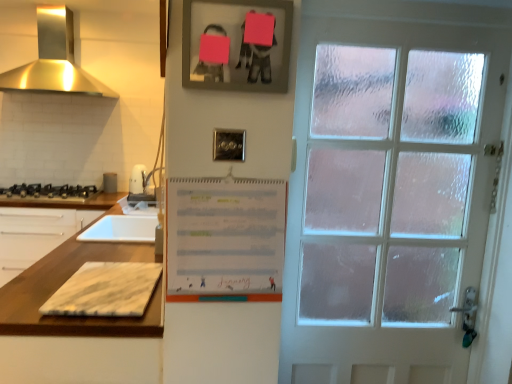
Image resolution: width=512 pixels, height=384 pixels. What are the coordinates of `black matte gas stove at left` in the screenshot? It's located at (49, 191).

Is metallic silver toaster at left wider than satin gold stainless steel exhaust hood at upper left?

Incorrect, the width of metallic silver toaster at left does not surpass that of satin gold stainless steel exhaust hood at upper left.

From the image's perspective, is metallic silver toaster at left under satin gold stainless steel exhaust hood at upper left?

Yes.

Can you confirm if metallic silver toaster at left is positioned to the right of satin gold stainless steel exhaust hood at upper left?

Indeed, metallic silver toaster at left is positioned on the right side of satin gold stainless steel exhaust hood at upper left.

Is satin gold stainless steel exhaust hood at upper left surrounded by metallic silver toaster at left?

Definitely not — satin gold stainless steel exhaust hood at upper left is not inside metallic silver toaster at left.

How many degrees apart are the facing directions of satin gold stainless steel exhaust hood at upper left and marble cutting board at lower left?

The angle between the facing direction of satin gold stainless steel exhaust hood at upper left and the facing direction of marble cutting board at lower left is 90.5 degrees.

Would you say satin gold stainless steel exhaust hood at upper left is a long distance from marble cutting board at lower left?

Yes, satin gold stainless steel exhaust hood at upper left and marble cutting board at lower left are located far from each other.

In the scene shown: Who is shorter, satin gold stainless steel exhaust hood at upper left or marble cutting board at lower left?

marble cutting board at lower left is shorter.

In the image, is satin gold stainless steel exhaust hood at upper left positioned in front of or behind marble cutting board at lower left?

Clearly, satin gold stainless steel exhaust hood at upper left is behind marble cutting board at lower left.

Who is bigger, satin gold stainless steel exhaust hood at upper left or white paper at center?

With larger size is satin gold stainless steel exhaust hood at upper left.

Is satin gold stainless steel exhaust hood at upper left thinner than white paper at center?

No.

Is satin gold stainless steel exhaust hood at upper left closer to camera compared to white paper at center?

No, satin gold stainless steel exhaust hood at upper left is further to the viewer.

Does white paper at center appear on the right side of marble cutting board at lower left?

Yes, white paper at center is to the right of marble cutting board at lower left.

Is white paper at center inside or outside of marble cutting board at lower left?

white paper at center is not inside marble cutting board at lower left, it's outside.

Does white paper at center lie in front of marble cutting board at lower left?

Yes.

Find the location of a particular element. bulletin board above the marble cutting board at lower left (from the image's perspective) is located at coordinates pos(225,239).

Between point (44, 257) and point (134, 305), which one is positioned behind?

Point (44, 257)

From the image's perspective, is white marble cutting board at left under marble cutting board at lower left?

Yes, from the image's perspective, white marble cutting board at left is beneath marble cutting board at lower left.

Based on the photo, is white marble cutting board at left closer to the viewer compared to marble cutting board at lower left?

No, the depth of white marble cutting board at left is greater than that of marble cutting board at lower left.

Considering the relative sizes of white paper at center and white marble cutting board at left in the image provided, is white paper at center bigger than white marble cutting board at left?

No.

Is point (216, 186) closer or farther from the camera than point (60, 278)?

Point (216, 186) is closer to the camera than point (60, 278).

Is white paper at center turned away from white marble cutting board at left?

No, white paper at center is not facing away from white marble cutting board at left.

Is black matte gas stove at left beside metallic silver picture frame at upper center?

No, black matte gas stove at left is not with metallic silver picture frame at upper center.

In the scene shown: Can you confirm if black matte gas stove at left is shorter than metallic silver picture frame at upper center?

Correct, black matte gas stove at left is not as tall as metallic silver picture frame at upper center.

Is black matte gas stove at left to the left of metallic silver picture frame at upper center from the viewer's perspective?

Yes.

Between black matte gas stove at left and metallic silver picture frame at upper center, which one has smaller width?

With smaller width is metallic silver picture frame at upper center.

You are a GUI agent. You are given a task and a screenshot of the screen. Output one action in this format:
    pyautogui.click(x=<x>, y=<y>)
    Task: Click on the exhaust hood above the metallic silver toaster at left (from the image's perspective)
    
    Given the screenshot: What is the action you would take?
    pyautogui.click(x=54, y=60)

Where is `cardboard on the right of the satin gold stainless steel exhaust hood at upper left`? This screenshot has height=384, width=512. cardboard on the right of the satin gold stainless steel exhaust hood at upper left is located at coordinates (105, 290).

When comparing their distances from satin gold stainless steel exhaust hood at upper left, does black matte gas stove at left or metallic silver toaster at left seem further?

Among the two, metallic silver toaster at left is located further to satin gold stainless steel exhaust hood at upper left.

Considering their positions, is metallic silver picture frame at upper center positioned closer to satin gold stainless steel exhaust hood at upper left than white marble cutting board at left?

white marble cutting board at left lies closer to satin gold stainless steel exhaust hood at upper left than the other object.

Considering their positions, is white paper at center positioned further to marble cutting board at lower left than satin gold stainless steel exhaust hood at upper left?

satin gold stainless steel exhaust hood at upper left is further to marble cutting board at lower left.

Estimate the real-world distances between objects in this image. Which object is further from white paper at center, white marble cutting board at left or metallic silver picture frame at upper center?

metallic silver picture frame at upper center lies further to white paper at center than the other object.

Which object lies further to the anchor point white marble cutting board at left, metallic silver toaster at left or black matte gas stove at left?

metallic silver toaster at left.

When comparing their distances from metallic silver toaster at left, does white marble cutting board at left or satin gold stainless steel exhaust hood at upper left seem closer?

Among the two, satin gold stainless steel exhaust hood at upper left is located nearer to metallic silver toaster at left.

Which object lies nearer to the anchor point white marble cutting board at left, satin gold stainless steel exhaust hood at upper left or marble cutting board at lower left?

marble cutting board at lower left lies closer to white marble cutting board at left than the other object.

Based on their spatial positions, is white paper at center or satin gold stainless steel exhaust hood at upper left further from black matte gas stove at left?

white paper at center is positioned further to the anchor black matte gas stove at left.

Where is `cardboard between metallic silver picture frame at upper center and satin gold stainless steel exhaust hood at upper left in the front-back direction`? This screenshot has height=384, width=512. cardboard between metallic silver picture frame at upper center and satin gold stainless steel exhaust hood at upper left in the front-back direction is located at coordinates (105, 290).

At what (x,y) coordinates should I click in order to perform the action: click on bulletin board between metallic silver picture frame at upper center and black matte gas stove at left from front to back. Please return your answer as a coordinate pair (x, y). Looking at the image, I should click on (225, 239).

The height and width of the screenshot is (384, 512). I want to click on countertop between metallic silver picture frame at upper center and black matte gas stove at left in the front-back direction, so click(x=63, y=283).

This screenshot has height=384, width=512. Find the location of `cardboard between white paper at center and white marble cutting board at left in the front-back direction`. cardboard between white paper at center and white marble cutting board at left in the front-back direction is located at coordinates point(105,290).